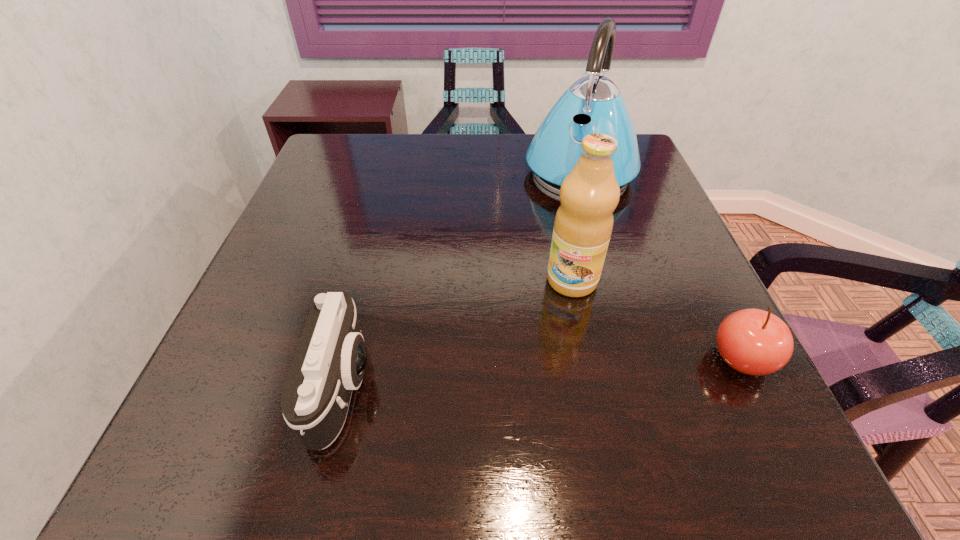
What are the coordinates of `free space between the kettle and the leftmost object` in the screenshot? It's located at coord(462,278).

Where is `free spot between the apple and the third nearest object`? Image resolution: width=960 pixels, height=540 pixels. free spot between the apple and the third nearest object is located at coordinates (657, 320).

Identify the location of empty space that is in between the camera and the apple. This screenshot has width=960, height=540. (542, 372).

Where is `free space between the kettle and the apple`? The height and width of the screenshot is (540, 960). free space between the kettle and the apple is located at coordinates (660, 265).

You are a GUI agent. You are given a task and a screenshot of the screen. Output one action in this format:
    pyautogui.click(x=<x>, y=<y>)
    Task: Click on the vacant space that is in between the second tallest object and the camera
    The height and width of the screenshot is (540, 960).
    Given the screenshot: What is the action you would take?
    pyautogui.click(x=458, y=333)

I want to click on free space between the shortest object and the kettle, so click(x=660, y=265).

The image size is (960, 540). What are the coordinates of `object that stands as the closest to the farthest object` in the screenshot? It's located at (589, 194).

Select which object appears as the third closest to the shortest object. Please provide its 2D coordinates. Your answer should be formatted as a tuple, i.e. [(x, y)], where the tuple contains the x and y coordinates of a point satisfying the conditions above.

[(330, 359)]